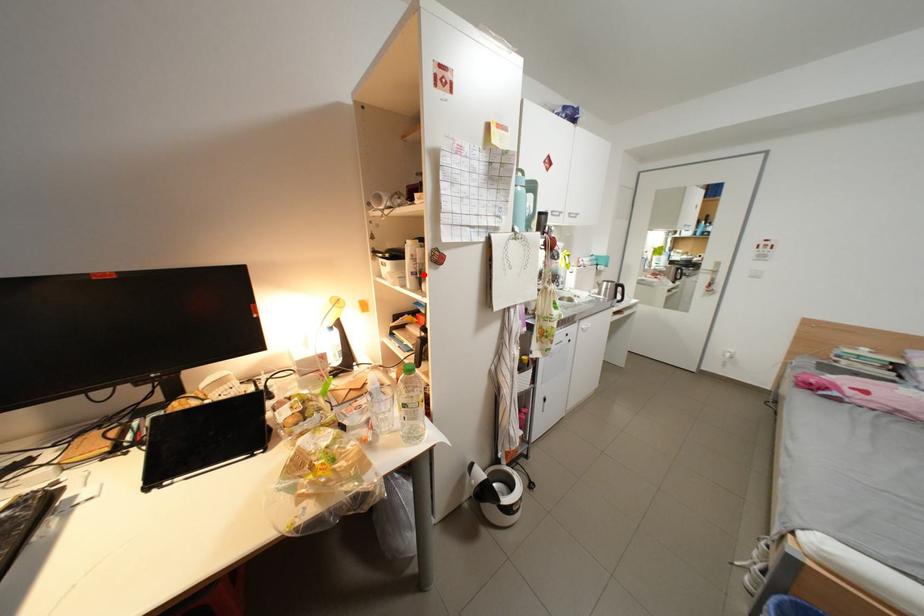
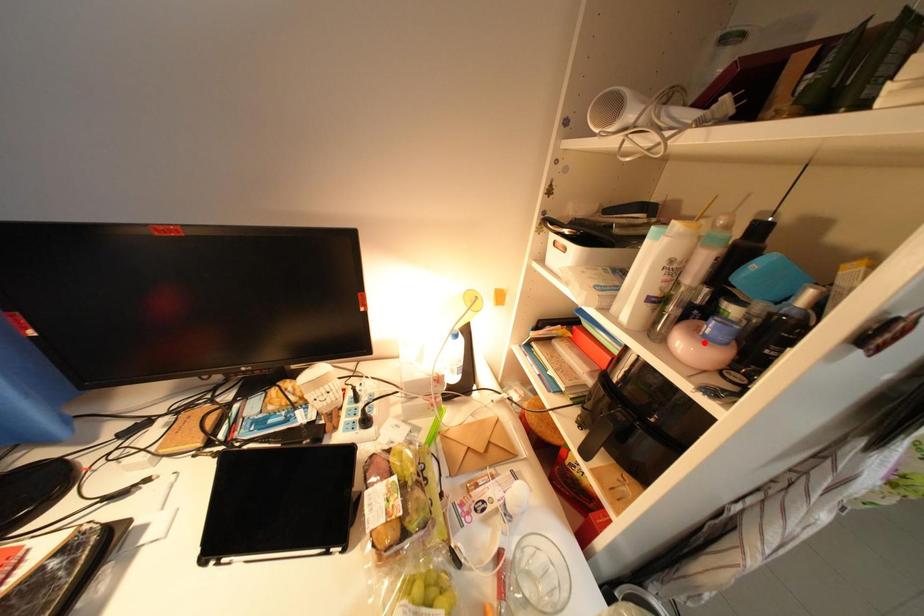
I am providing you with two images of the same scene from different viewpoints. A red point is marked on the first image and another point is marked on the second image. Are the points marked in image1 and image2 representing the same 3D position?

No